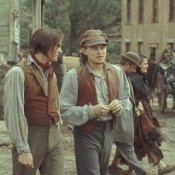
Locate an element on the screen. The width and height of the screenshot is (175, 175). door is located at coordinates (152, 54).